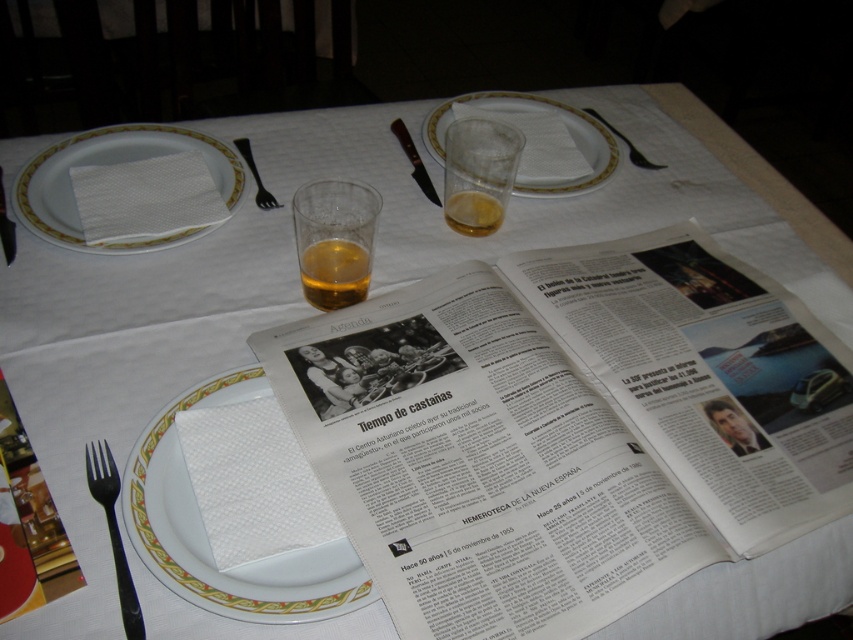
You are a photographer taking a picture of the table setting. The camera is positioned at a certain distance. Can you estimate how far the point at coordinates point (314, 250) is from the camera in centimeters?

A: The point at coordinates point (314, 250) is 68.87 centimeters away from the camera.

You are a waiter at a Spanish restaurant. You see an amber liquid glass at center and a black plastic fork at lower left on the table. Which item is closer to the edge of the table?

The black plastic fork at lower left is closer to the edge of the table because the amber liquid glass at center is located above it, meaning it is positioned further inward from the edge.